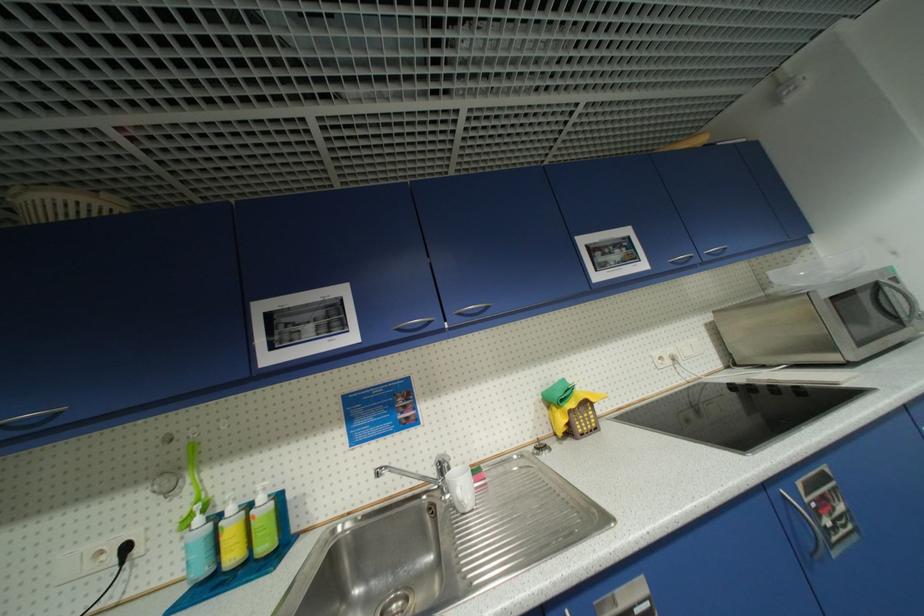
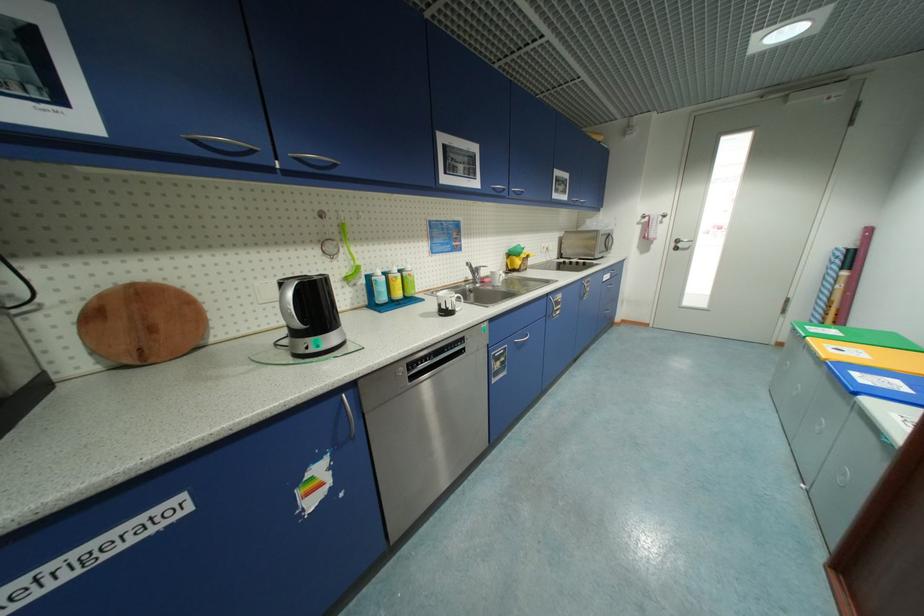
Locate, in the second image, the point that corresponds to pixel 648 267 in the first image.

(570, 199)